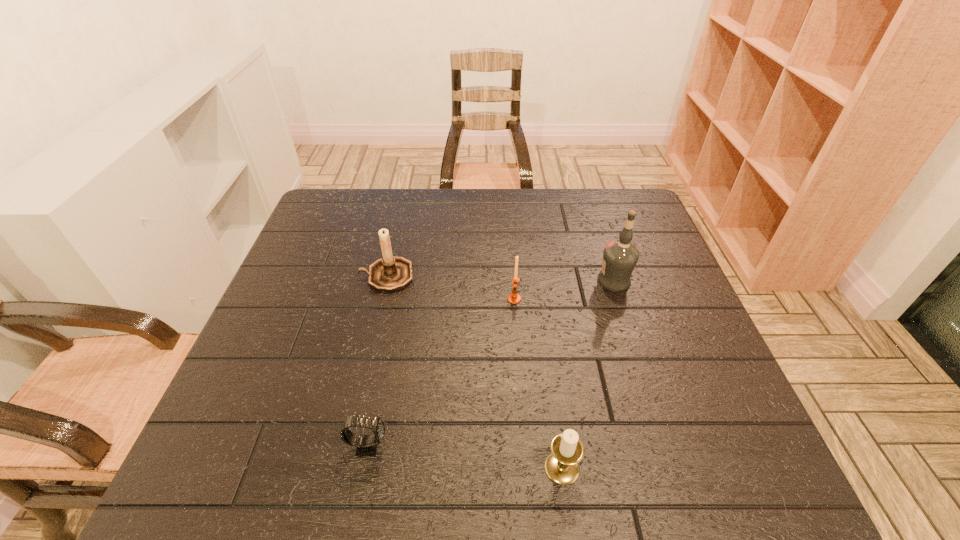
Find the location of `vodka`. vodka is located at coordinates (620, 257).

Where is `the tallest object`? the tallest object is located at coordinates (620, 257).

At what (x,y) coordinates should I click in order to perform the action: click on the farthest candle holder. Please return your answer as a coordinate pair (x, y). Looking at the image, I should click on (389, 274).

Locate an element on the screen. The width and height of the screenshot is (960, 540). the second candle holder from left to right is located at coordinates (514, 298).

This screenshot has height=540, width=960. Find the location of `the second nearest candle holder`. the second nearest candle holder is located at coordinates (514, 298).

Locate an element on the screen. The height and width of the screenshot is (540, 960). the rightmost candle holder is located at coordinates (562, 465).

Image resolution: width=960 pixels, height=540 pixels. Find the location of `the second shortest object`. the second shortest object is located at coordinates (562, 465).

This screenshot has width=960, height=540. Identify the location of watch. (366, 446).

Find the location of a particular element. The width and height of the screenshot is (960, 540). free region located 0.310m on the front label of the rightmost object is located at coordinates (479, 281).

Where is `free point located 0.390m on the front label of the rightmost object`? free point located 0.390m on the front label of the rightmost object is located at coordinates (449, 281).